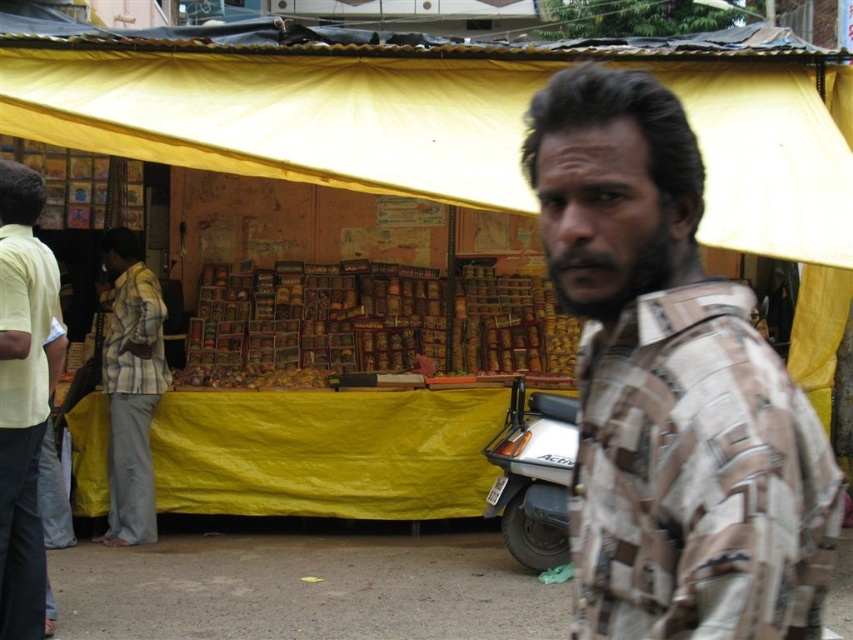
Is the position of camouflage shirt at center more distant than that of light yellow shirt at left?

No.

Is point (697, 154) closer to viewer compared to point (24, 380)?

Yes.

Describe the element at coordinates (670, 387) in the screenshot. I see `camouflage shirt at center` at that location.

Locate an element on the screen. camouflage shirt at center is located at coordinates (670, 387).

Does point (22, 580) come in front of point (106, 385)?

Yes, point (22, 580) is closer to viewer.

Who is positioned more to the right, light yellow shirt at left or striped cotton shirt at left?

Positioned to the right is light yellow shirt at left.

Which is in front, point (0, 372) or point (107, 237)?

Point (0, 372) is in front.

Find the location of a particular element. This screenshot has height=640, width=853. light yellow shirt at left is located at coordinates (22, 397).

Can you confirm if yellow fabric canopy at upper center is positioned to the left of light yellow shirt at left?

No, yellow fabric canopy at upper center is not to the left of light yellow shirt at left.

Does point (778, 184) come behind point (33, 260)?

Yes, it is behind point (33, 260).

Where is `yellow fabric canopy at upper center`? yellow fabric canopy at upper center is located at coordinates (428, 115).

Find the location of `yellow fabric canopy at upper center`. yellow fabric canopy at upper center is located at coordinates (428, 115).